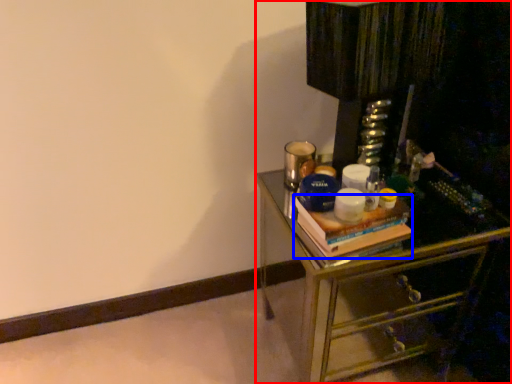
Question: Which object appears farthest to the camera in this image, chest of drawers (highlighted by a red box) or book (highlighted by a blue box)?

Choices:
 (A) chest of drawers
 (B) book

Answer: (B)